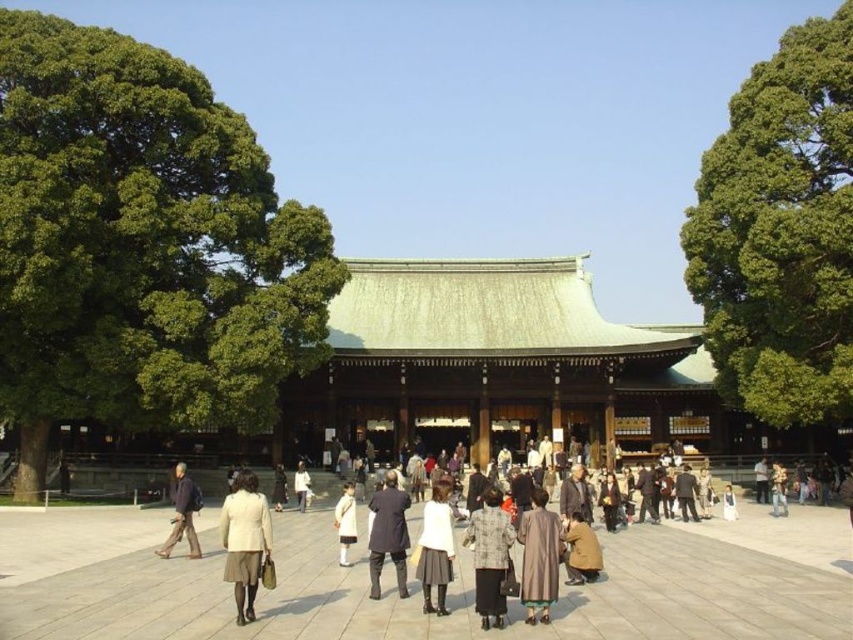
Does point (347, 499) lie in front of point (305, 504)?

That is True.

This screenshot has width=853, height=640. Find the location of `white matte coat at center`. white matte coat at center is located at coordinates (345, 522).

Between point (341, 508) and point (305, 499), which one is positioned in front?

Point (341, 508) is more forward.

I want to click on white matte coat at center, so click(x=345, y=522).

Can you confirm if plaid wool coat at center is smaller than brown textured coat at center?

No, plaid wool coat at center is not smaller than brown textured coat at center.

Is plaid wool coat at center below brown textured coat at center?

Indeed, plaid wool coat at center is positioned under brown textured coat at center.

At what (x,y) coordinates should I click in order to perform the action: click on plaid wool coat at center. Please return your answer as a coordinate pair (x, y). Looking at the image, I should click on (489, 556).

Is light beige skirt at center further to camera compared to light brown leather jacket at center?

No, it is not.

Can you confirm if light beige skirt at center is bigger than light brown leather jacket at center?

Correct, light beige skirt at center is larger in size than light brown leather jacket at center.

Between point (248, 556) and point (300, 468), which one is positioned behind?

Positioned behind is point (300, 468).

At what (x,y) coordinates should I click in order to perform the action: click on light beige skirt at center. Please return your answer as a coordinate pair (x, y). The height and width of the screenshot is (640, 853). Looking at the image, I should click on (245, 541).